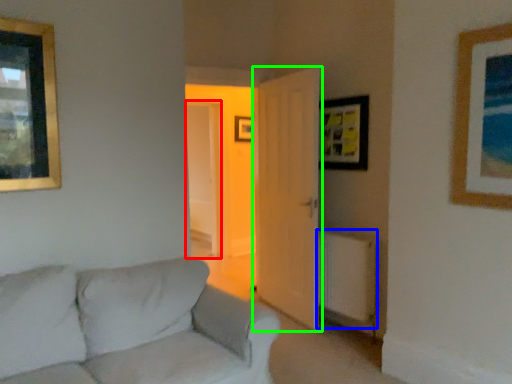
Question: Estimate the real-world distances between objects in this image. Which object is closer to glass door (highlighted by a red box), radiator (highlighted by a blue box) or door (highlighted by a green box)?

Choices:
 (A) radiator
 (B) door

Answer: (B)